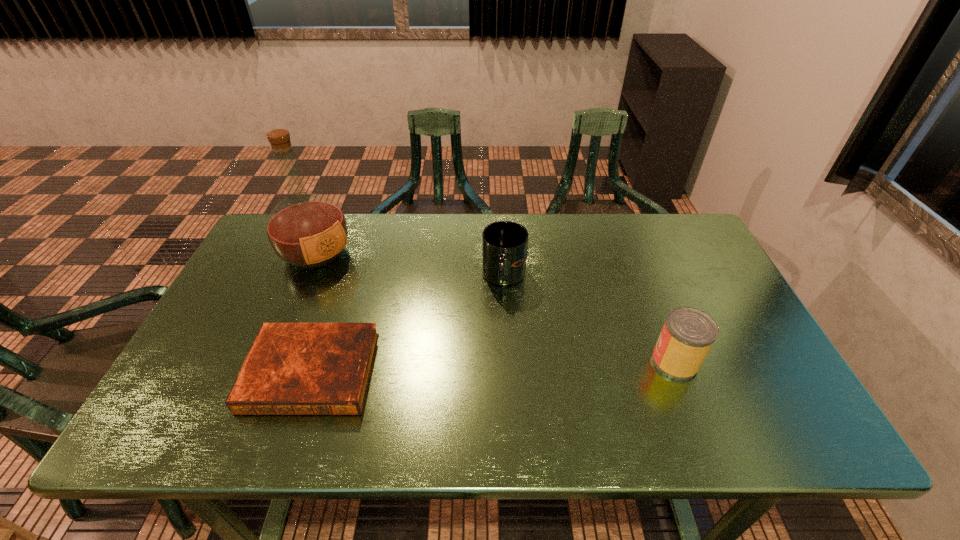
At what (x,y) coordinates should I click in order to perform the action: click on the shortest object. Please return your answer as a coordinate pair (x, y). Looking at the image, I should click on (292, 368).

The height and width of the screenshot is (540, 960). Find the location of `can`. can is located at coordinates (688, 333).

The image size is (960, 540). In order to click on the second object from right to left in this screenshot , I will do `click(504, 243)`.

I want to click on the tallest object, so pos(306,230).

What are the coordinates of `vacant space located on the left of the rightmost object` in the screenshot? It's located at (499, 361).

Locate an element on the screen. vacant position located 0.290m with the handle on the side of the mug is located at coordinates (452, 378).

You are a GUI agent. You are given a task and a screenshot of the screen. Output one action in this format:
    pyautogui.click(x=<x>, y=<y>)
    Task: Click on the vacant area situated 0.280m with the handle on the side of the mug
    
    Given the screenshot: What is the action you would take?
    pyautogui.click(x=454, y=375)

Locate an element on the screen. vacant space located 0.080m with the handle on the side of the mug is located at coordinates (486, 316).

Where is `vacant space located 0.120m on the front label of the liquor`? The height and width of the screenshot is (540, 960). vacant space located 0.120m on the front label of the liquor is located at coordinates (359, 292).

At what (x,y) coordinates should I click in order to perform the action: click on vacant area located 0.180m on the front label of the liquor. Please return your answer as a coordinate pair (x, y). This screenshot has width=960, height=540. Looking at the image, I should click on (372, 303).